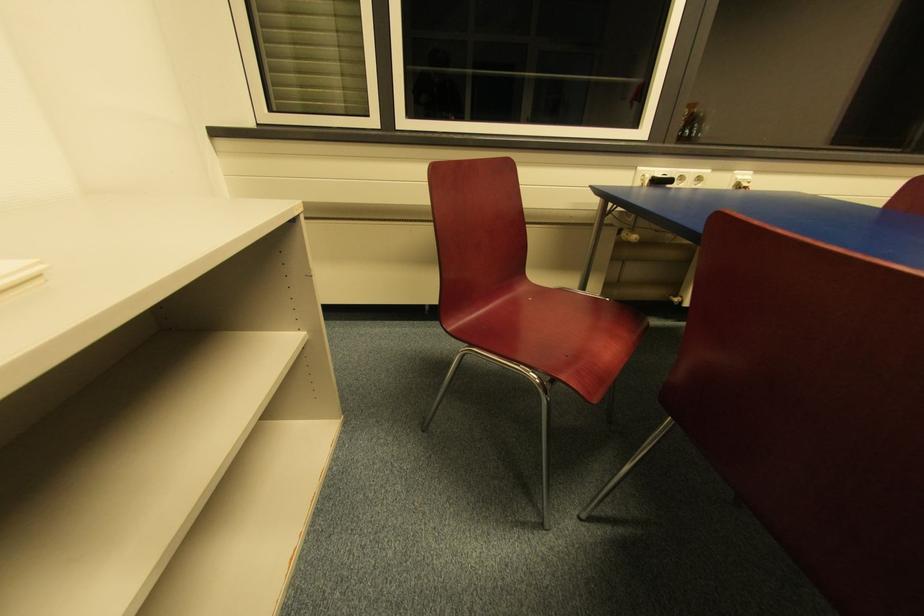
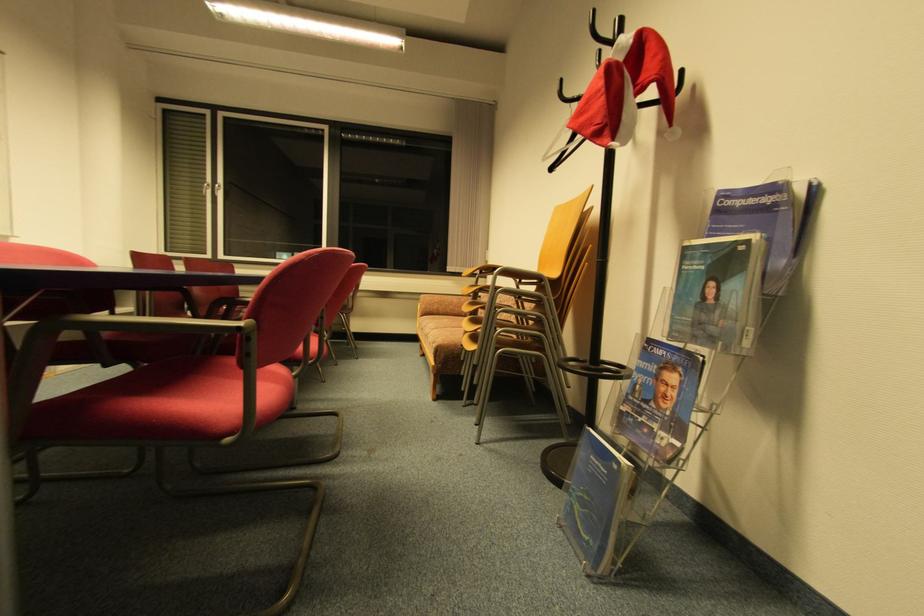
Which direction would the cameraman need to move to produce the second image?

The cameraman walked toward right, backward.